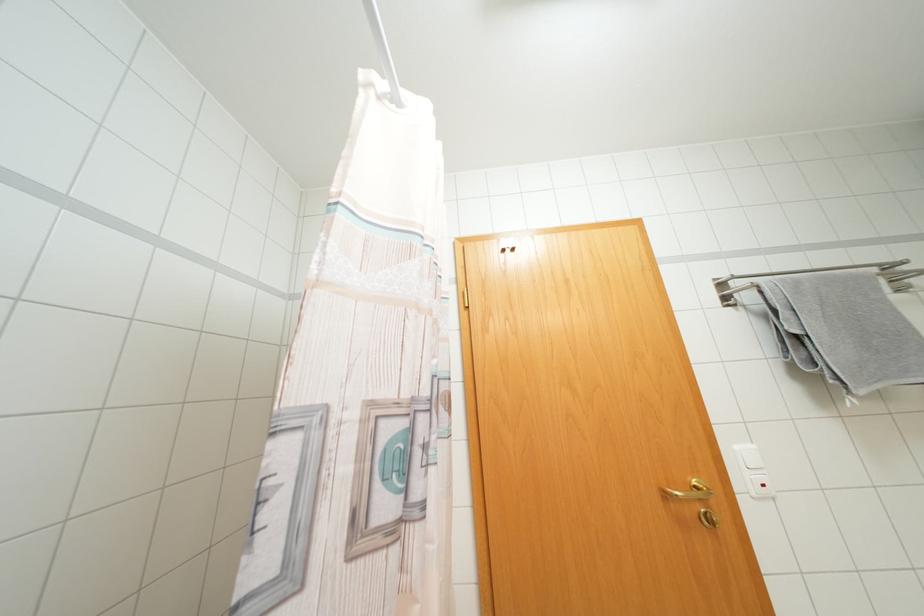
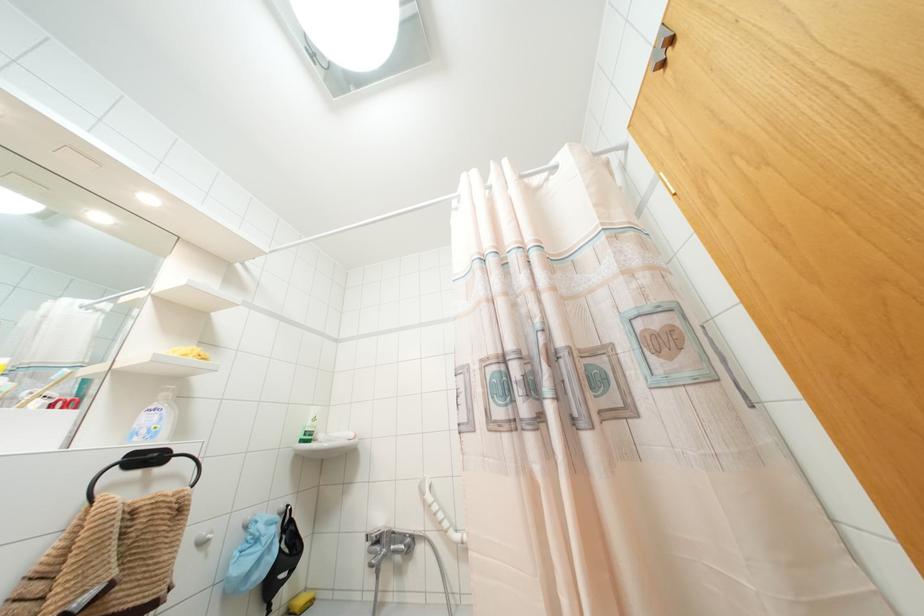
The images are taken continuously from a first-person perspective. In which direction is your viewpoint rotating?

The rotation direction of the camera is left-up.